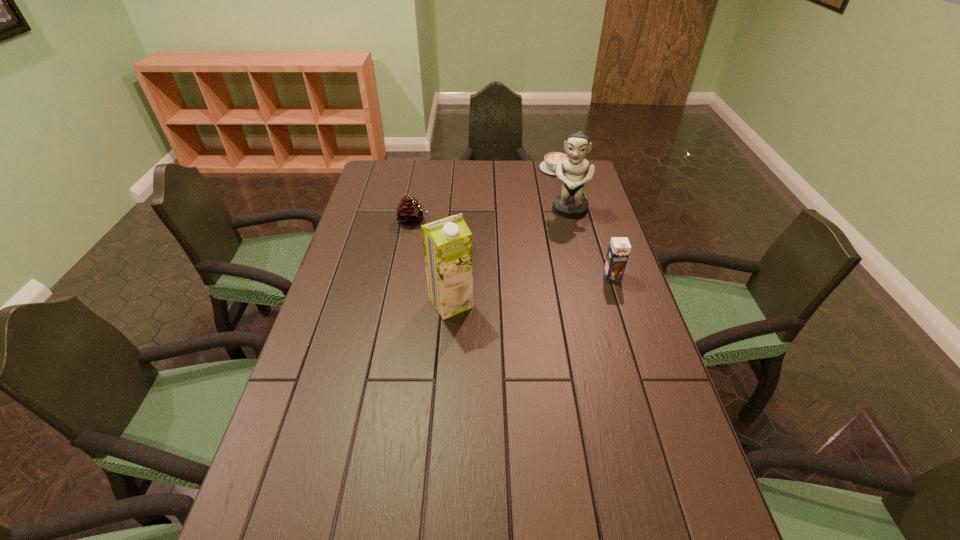
Image resolution: width=960 pixels, height=540 pixels. I want to click on free space at the far left corner of the desktop, so click(x=402, y=165).

This screenshot has width=960, height=540. I want to click on free space at the near left corner of the desktop, so click(x=310, y=515).

You are a GUI agent. You are given a task and a screenshot of the screen. Output one action in this format:
    pyautogui.click(x=<x>, y=<y>)
    Task: Click on the unoccupied position between the figurine and the chocolate milk
    
    Given the screenshot: What is the action you would take?
    pyautogui.click(x=590, y=244)

Where is `vacant point located between the nearest object and the figurine`? This screenshot has width=960, height=540. vacant point located between the nearest object and the figurine is located at coordinates (510, 256).

At what (x,y) coordinates should I click in order to perform the action: click on free area in between the shortest object and the chocolate milk. Please return your answer as a coordinate pair (x, y). Image resolution: width=960 pixels, height=540 pixels. Looking at the image, I should click on (584, 222).

At what (x,y) coordinates should I click in order to perform the action: click on free space between the figurine and the soya milk. Please return your answer as a coordinate pair (x, y). Looking at the image, I should click on (510, 256).

You are a GUI agent. You are given a task and a screenshot of the screen. Output one action in this format:
    pyautogui.click(x=<x>, y=<y>)
    Task: Click on the empty location between the leftmost object and the chocolate milk
    This screenshot has height=540, width=960.
    Given the screenshot: What is the action you would take?
    pyautogui.click(x=513, y=248)

This screenshot has height=540, width=960. Identify the location of empty space between the figurine and the fourth tallest object. (492, 215).

Find the location of a particular element. free spot between the fourth farthest object and the nearest object is located at coordinates (532, 290).

I want to click on free space between the fourth tallest object and the second nearest object, so click(x=513, y=248).